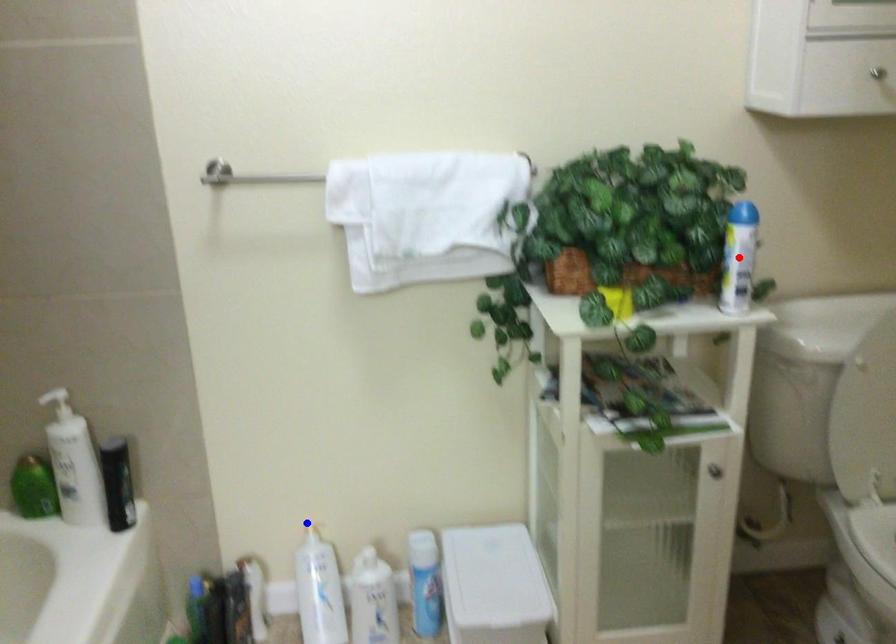
Question: Which of the two points in the image is closer to the camera?

Choices:
 (A) Blue point is closer.
 (B) Red point is closer.

Answer: (B)